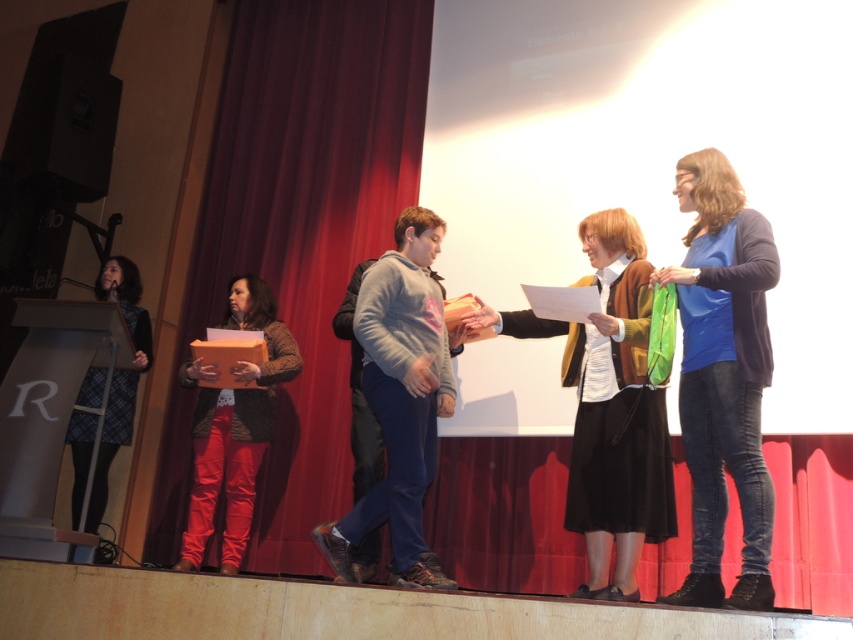
Question: Which object is the farthest from the matte brown cardigan at center?

Choices:
 (A) plaid skirt at left
 (B) blue matte shirt at right
 (C) gray fleece hoodie at center
 (D) red velvet curtain at center

Answer: (A)

Question: Does gray fleece hoodie at center come behind matte brown jacket at center?

Choices:
 (A) no
 (B) yes

Answer: (A)

Question: Is red velvet curtain at center to the left of blue matte shirt at right from the viewer's perspective?

Choices:
 (A) no
 (B) yes

Answer: (B)

Question: Where is gray fleece hoodie at center located in relation to plaid skirt at left in the image?

Choices:
 (A) above
 (B) below

Answer: (A)

Question: Which object is closer to the camera taking this photo?

Choices:
 (A) plaid skirt at left
 (B) matte brown cardigan at center
 (C) red velvet curtain at center

Answer: (B)

Question: Among these objects, which one is farthest from the camera?

Choices:
 (A) red velvet curtain at center
 (B) gray fleece hoodie at center
 (C) blue matte shirt at right
 (D) matte brown jacket at center

Answer: (A)